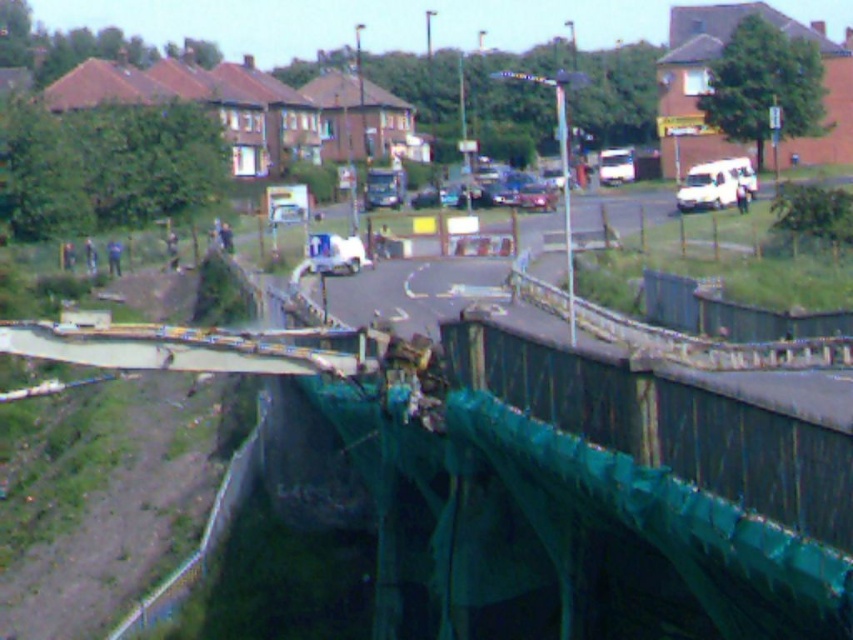
Which is in front, point (675, 198) or point (552, 195)?

Point (675, 198) is in front.

Can you confirm if white matte van at upper right is thinner than shiny silver car at center?

No, white matte van at upper right is not thinner than shiny silver car at center.

Is point (682, 182) closer to viewer compared to point (526, 200)?

No.

Where is `white matte van at upper right`? The width and height of the screenshot is (853, 640). white matte van at upper right is located at coordinates (717, 182).

Looking at this image, who is positioned more to the left, metallic gray bridge at center or shiny silver car at center?

From the viewer's perspective, metallic gray bridge at center appears more on the left side.

Based on the photo, can you confirm if metallic gray bridge at center is positioned to the right of shiny silver car at center?

In fact, metallic gray bridge at center is to the left of shiny silver car at center.

Identify the location of metallic gray bridge at center. (183, 348).

Identify the location of metallic gray bridge at center. The image size is (853, 640). (183, 348).

Between white matte van at center and shiny silver car at center, which one appears on the left side from the viewer's perspective?

Positioned to the left is white matte van at center.

Does point (358, 250) come behind point (527, 208)?

No, it is not.

Image resolution: width=853 pixels, height=640 pixels. I want to click on white matte van at center, so click(335, 253).